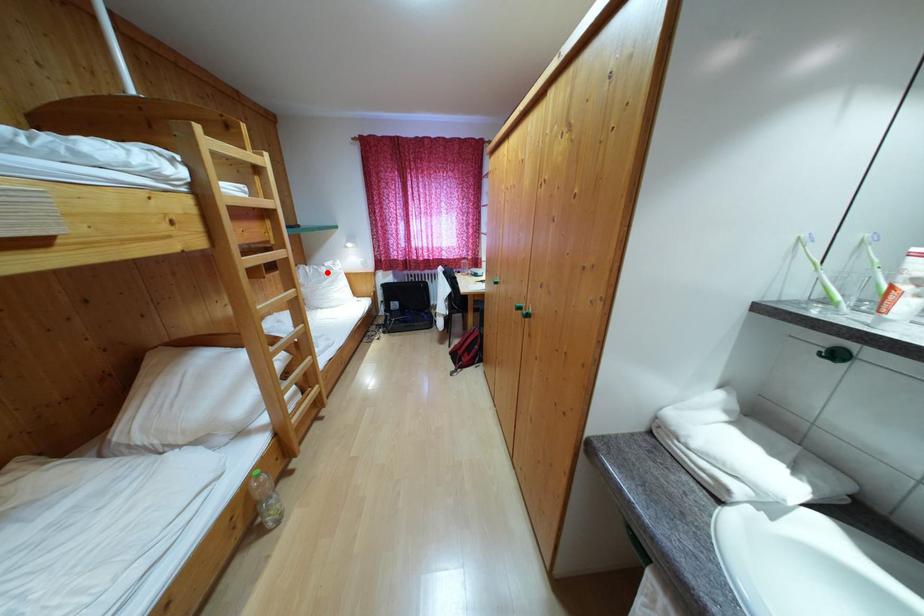
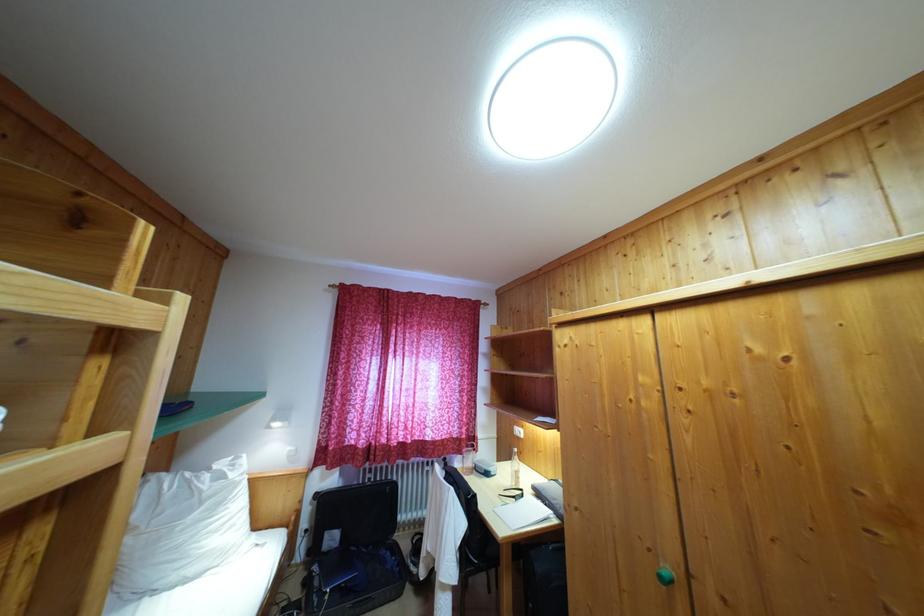
The point at the highlighted location is marked in the first image. Where is the corresponding point in the second image?

(213, 476)